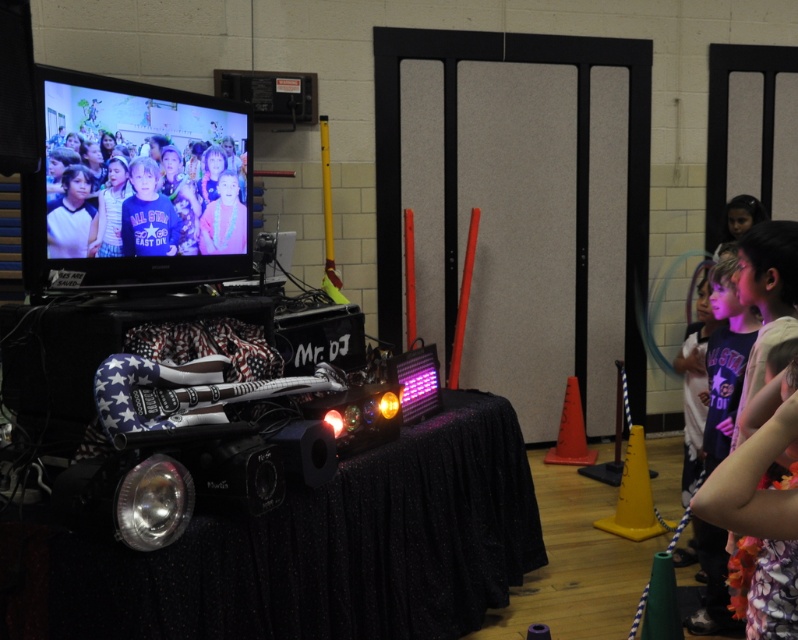
In the scene shown: You are a photographer at the event and need to capture both the matte black shirt at upper left and the floral dress at right in a single frame. Which clothing item should you focus on first to ensure both are in the frame?

The matte black shirt at upper left has a smaller size compared to the floral dress at right. Focus on the smaller matte black shirt at upper left first to ensure both are in the frame, as it requires more precise framing due to its smaller size.

You are a photographer at the event and need to capture a photo that includes both the matte black shirt at upper left and the floral dress at right. Based on their positions, which side of the frame should you focus on to ensure both are visible?

The matte black shirt at upper left is positioned on the left side of the floral dress at right, so focusing the camera frame on the center between their positions would ensure both are visible.